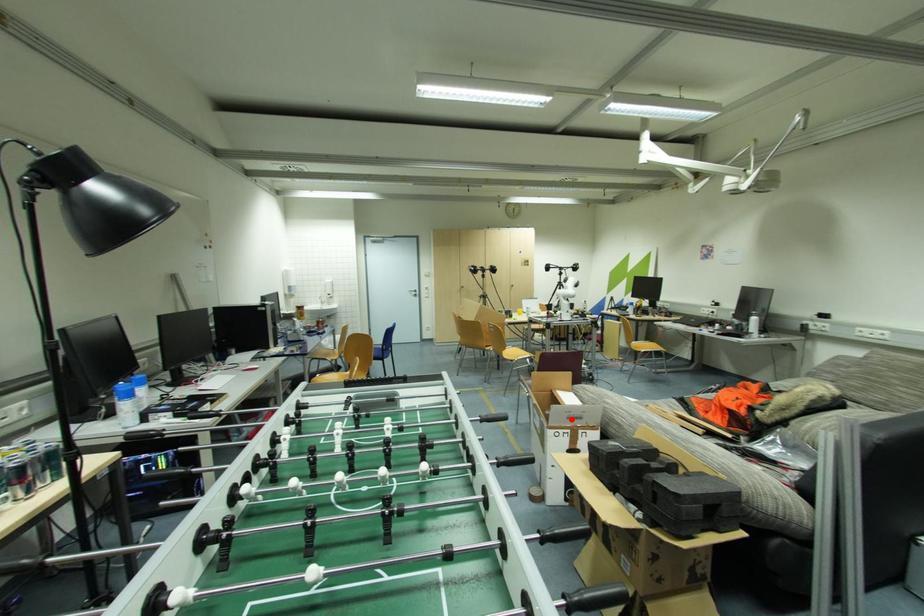
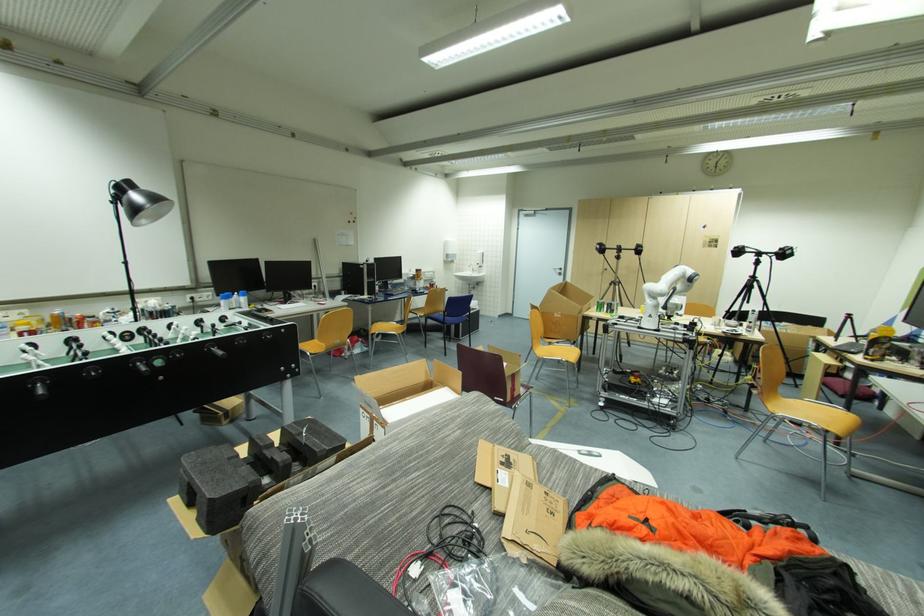
The point at the highlighted location is marked in the first image. Where is the corresponding point in the second image?

(369, 403)